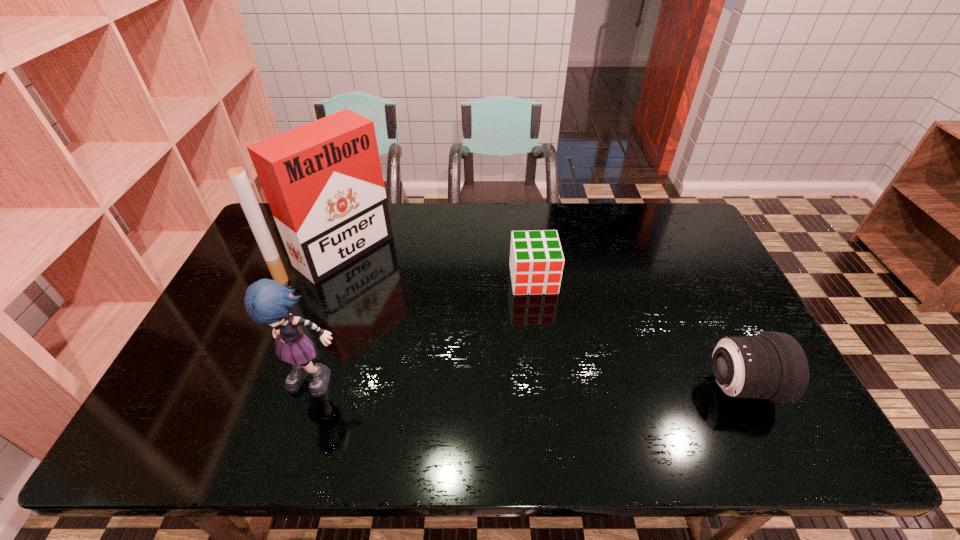
The width and height of the screenshot is (960, 540). In order to click on free space on the desktop that is between the rag doll and the rightmost object and is positioned on the front-facing side of the cigarette case in this screenshot , I will do `click(520, 383)`.

In order to click on free space on the desktop that is between the rag doll and the telephoto lens and is positioned on the red face of the third object from left to right in this screenshot , I will do `click(551, 384)`.